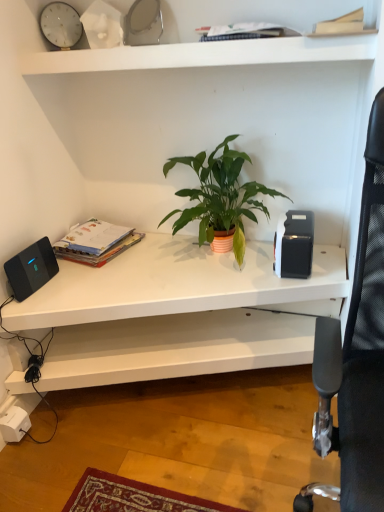
Locate an element on the screen. vacant area that lies between black matte speaker at left and matte paperbacks at left, which is counted as the first paperback book, starting from the back is located at coordinates (54, 280).